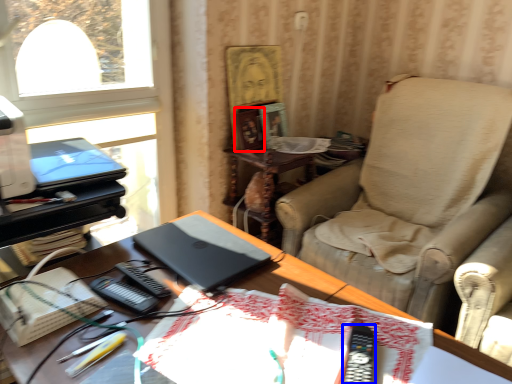
Question: Which of the following is the closest to the observer, picture frame (highlighted by a red box) or equipment (highlighted by a blue box)?

Choices:
 (A) picture frame
 (B) equipment

Answer: (B)